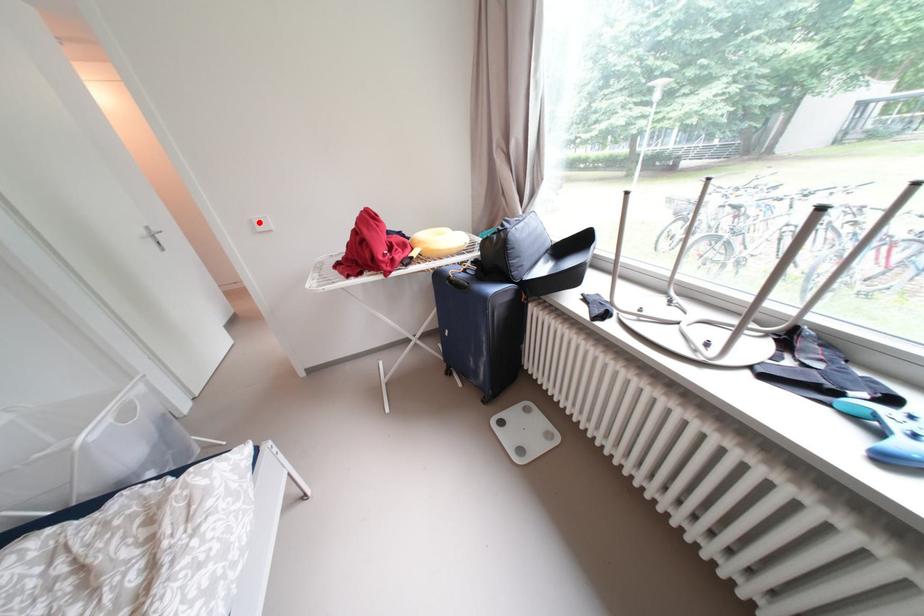
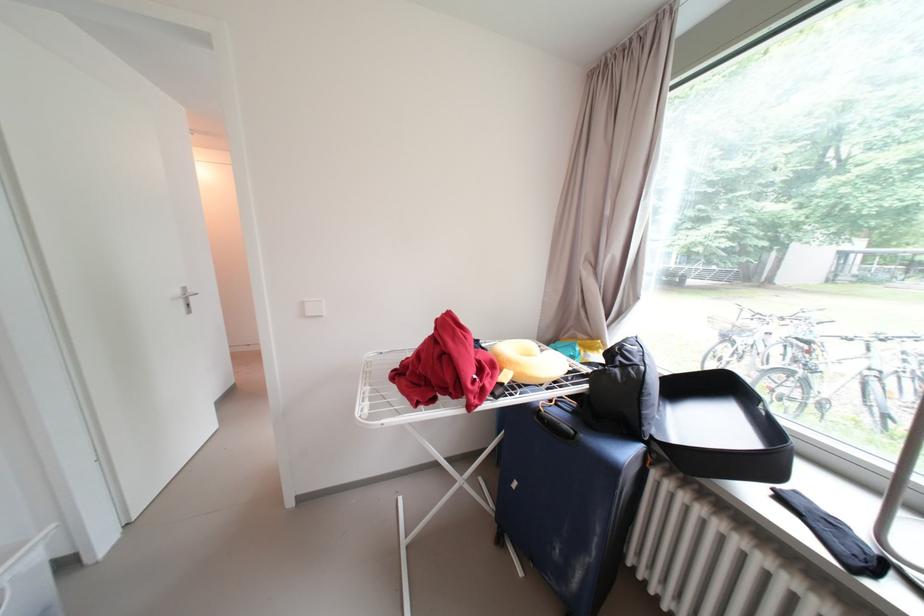
Find the pixel in the second image that matches the highlighted location in the first image.

(310, 305)